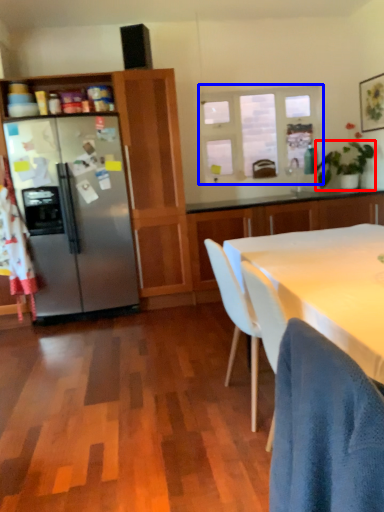
Question: Which object is further to the camera taking this photo, houseplant (highlighted by a red box) or window (highlighted by a blue box)?

Choices:
 (A) houseplant
 (B) window

Answer: (B)